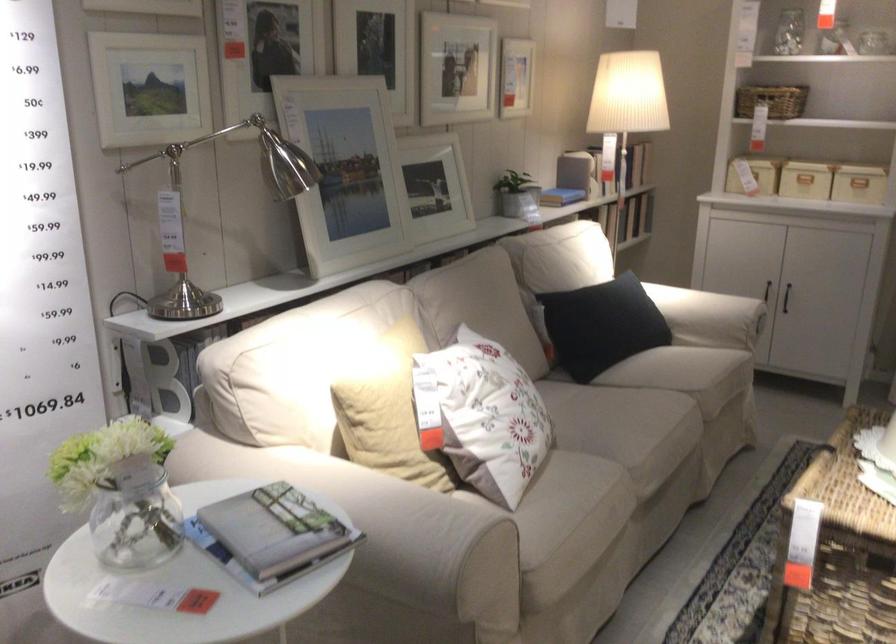
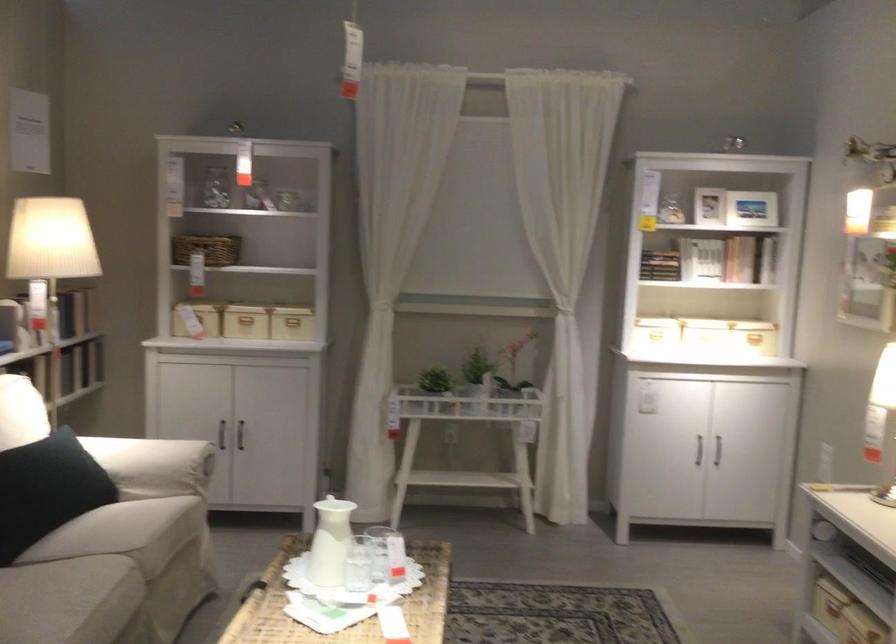
In the second image, find the point that corresponds to [805,158] in the first image.

(245, 319)